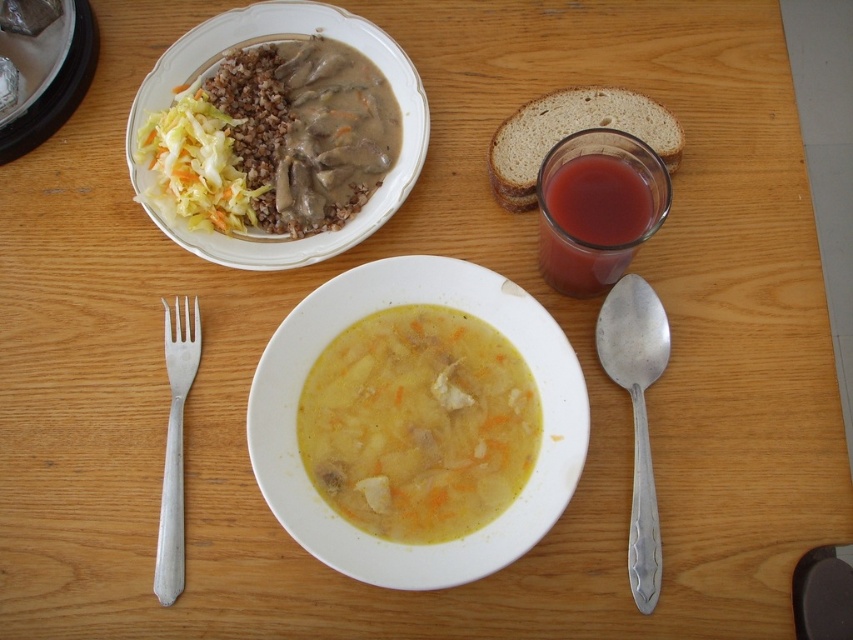
Does translucent glass juice at upper right appear over brown textured bread at upper right?

Actually, translucent glass juice at upper right is below brown textured bread at upper right.

Between point (589, 202) and point (526, 124), which one is positioned behind?

Point (526, 124)

What are the coordinates of `translucent glass juice at upper right` in the screenshot? It's located at (595, 218).

Which of these two, yellow matte soup at center or translucent glass juice at upper right, stands shorter?

translucent glass juice at upper right

The image size is (853, 640). In order to click on yellow matte soup at center in this screenshot , I will do `click(418, 422)`.

Does yellow matte soup at center appear on the left side of silver metallic spoon at right?

Correct, you'll find yellow matte soup at center to the left of silver metallic spoon at right.

Where is `yellow matte soup at center`? Image resolution: width=853 pixels, height=640 pixels. yellow matte soup at center is located at coordinates (418, 422).

Identify the location of yellow matte soup at center. (418, 422).